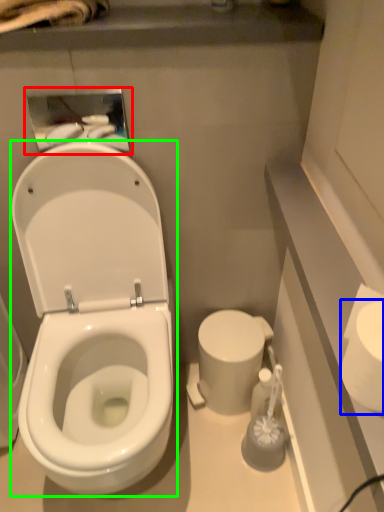
Question: Estimate the real-world distances between objects in this image. Which object is farther from medicine cabinet (highlighted by a red box), toilet paper (highlighted by a blue box) or wide (highlighted by a green box)?

Choices:
 (A) toilet paper
 (B) wide

Answer: (A)